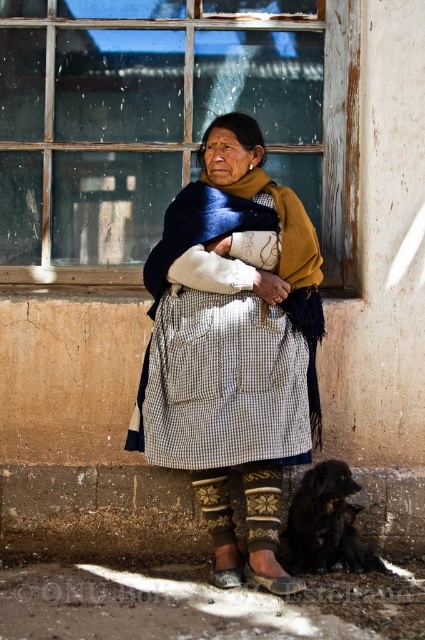
You are an observer standing in front of the scene. You notice the checkered fabric skirt at center and the black fur dog at lower right. Which object is positioned higher in the image?

The checkered fabric skirt at center is above the black fur dog at lower right, so the checkered fabric skirt at center is positioned higher in the image.

You are standing in the scene and want to move from the point at coordinates point (73, 240) to the point at coordinates point (257, 564). Which direction should you move to get closer to the second point?

To move from point (73, 240) to point (257, 564), you should move towards the right and upwards since point (257, 564) is located to the right and above point (73, 240).

You are an interior designer planning to place a new painting that is the same size as the black fur dog at lower right on the wall where the clear glass window at upper center is located. Can the painting fit horizontally on the wall without overlapping the window?

The clear glass window at upper center is wider than the black fur dog at lower right, so the painting can fit horizontally on the wall without overlapping the window.